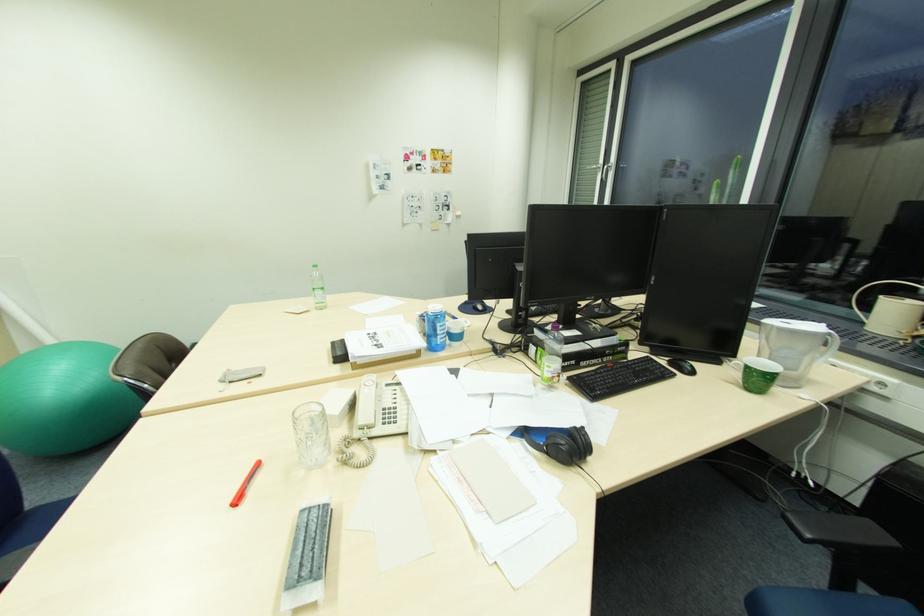
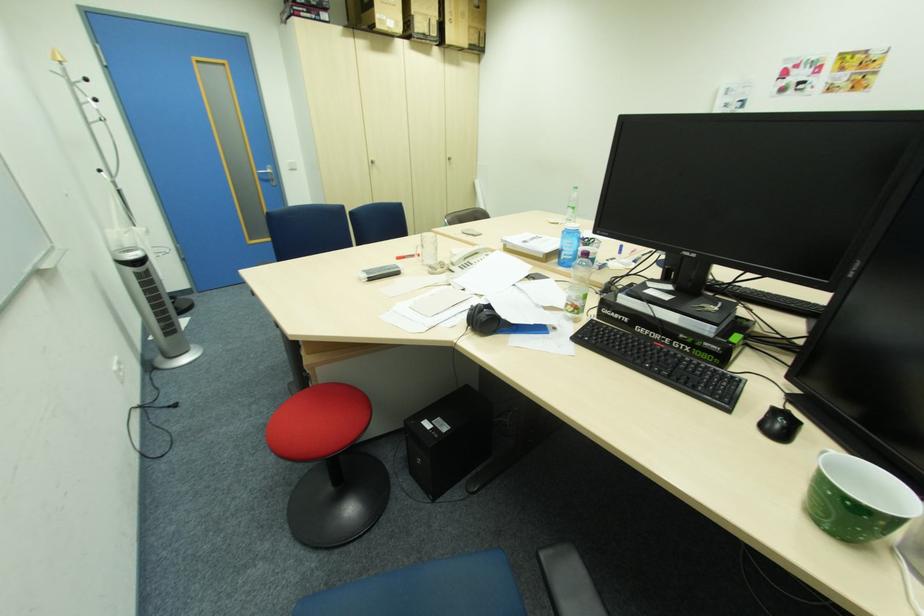
Where in the second image is the point corresponding to the point at 322,293 from the first image?

(574, 209)